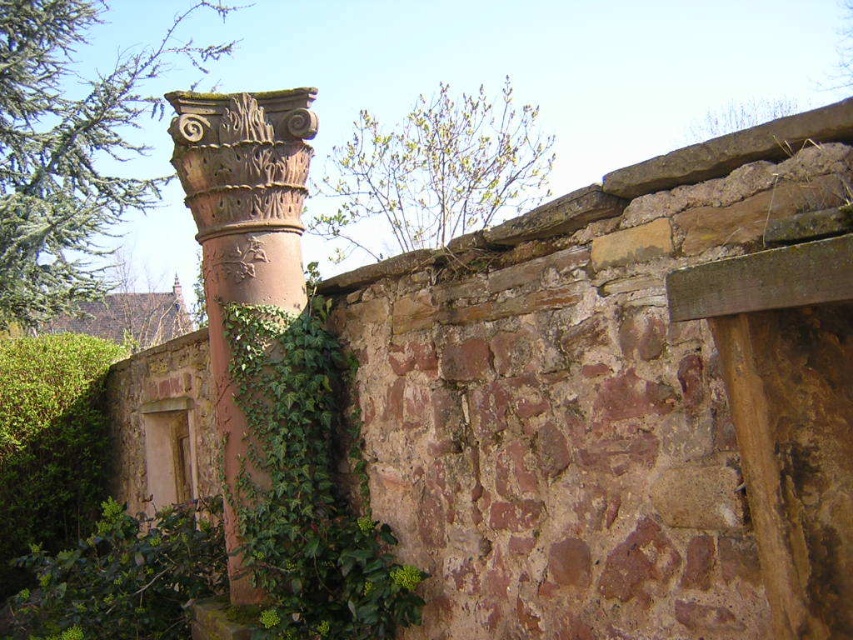
Question: Is rusty terracotta column at center-left to the left of green leafy tree at upper center from the viewer's perspective?

Choices:
 (A) no
 (B) yes

Answer: (B)

Question: From the image, what is the correct spatial relationship of green leafy tree at upper left in relation to rusty terracotta column at center-left?

Choices:
 (A) right
 (B) left

Answer: (B)

Question: Observing the image, what is the correct spatial positioning of green leafy tree at upper left in reference to rusty terracotta column at center-left?

Choices:
 (A) left
 (B) right

Answer: (A)

Question: Which object is positioned farthest from the green leafy tree at upper left?

Choices:
 (A) green leafy tree at upper center
 (B) rusty terracotta column at center-left

Answer: (B)

Question: Which point appears farthest from the camera in this image?

Choices:
 (A) (109, 145)
 (B) (273, 241)
 (C) (442, 157)

Answer: (C)

Question: Which point is closer to the camera?

Choices:
 (A) rusty terracotta column at center-left
 (B) green leafy tree at upper center

Answer: (A)